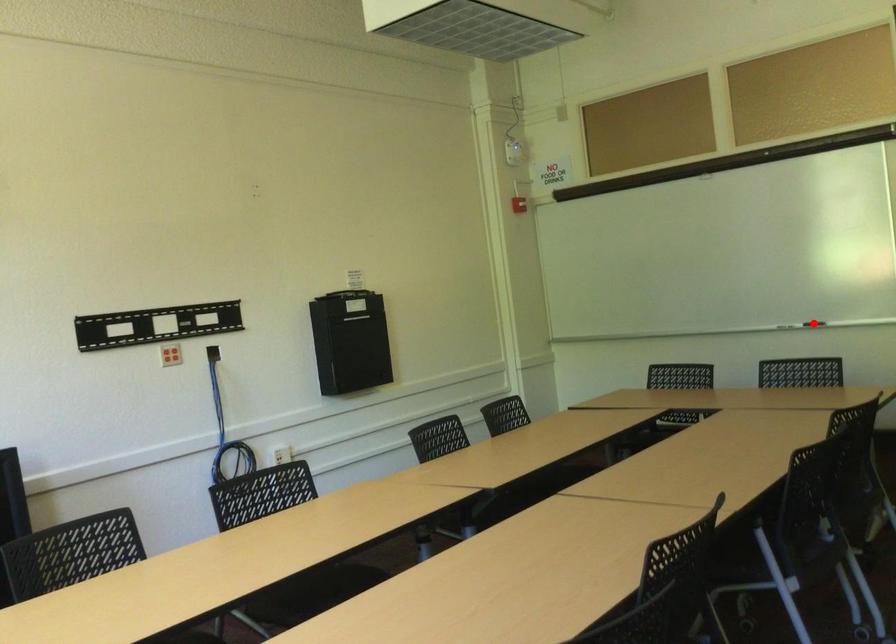
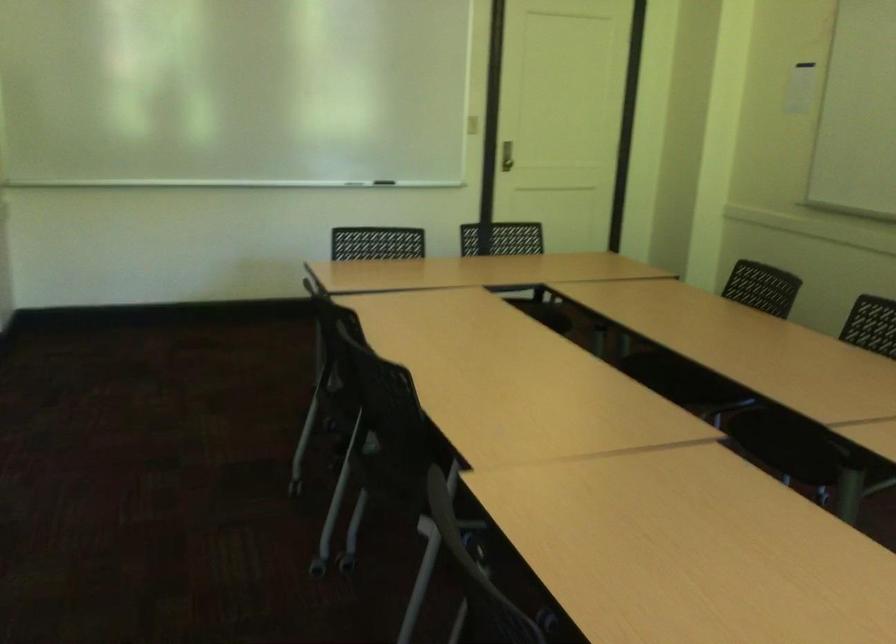
Question: I am providing you with two images of the same scene from different viewpoints. A red point is marked on the first image. Can you still see the location of the red point in image 2?

Choices:
 (A) Yes
 (B) No

Answer: (B)